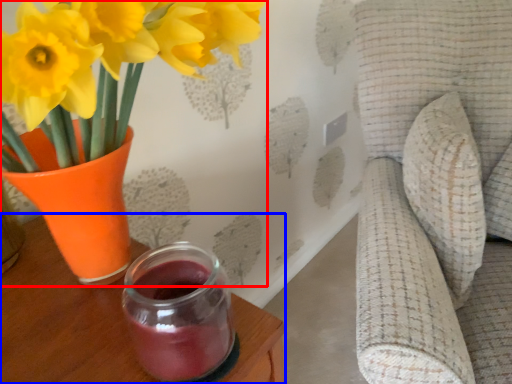
Question: Which object is closer to the camera taking this photo, houseplant (highlighted by a red box) or table (highlighted by a blue box)?

Choices:
 (A) houseplant
 (B) table

Answer: (A)